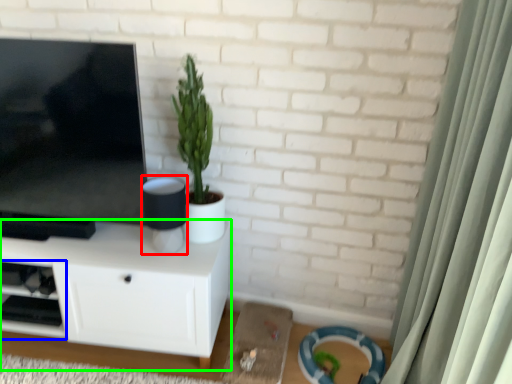
Question: Based on their relative distances, which object is nearer to speaker (highlighted by a red box)? Choose from shelf (highlighted by a blue box) and cabinetry (highlighted by a green box).

Choices:
 (A) shelf
 (B) cabinetry

Answer: (B)